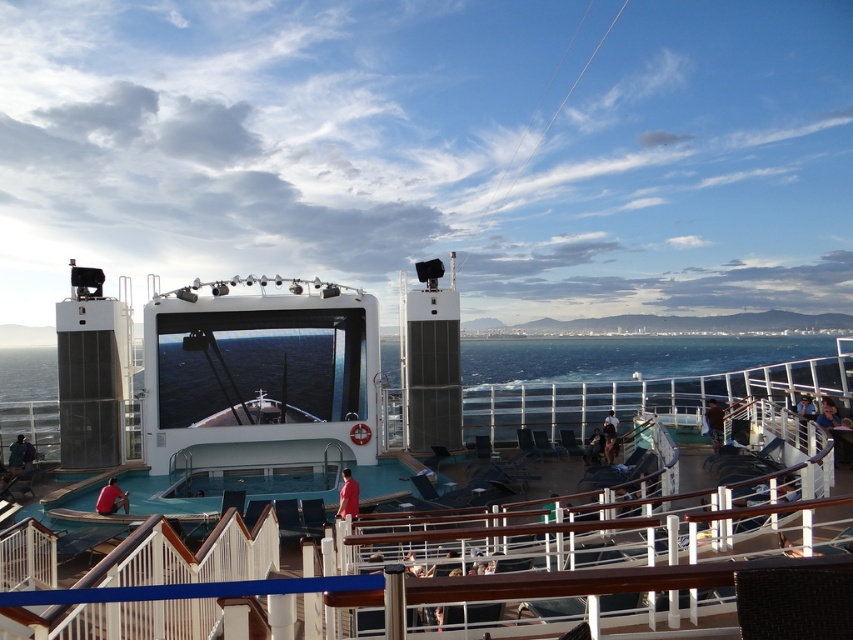
Question: Estimate the real-world distances between objects in this image. Which object is closer to the brown leather jacket at lower right?

Choices:
 (A) dark blue shirt at center
 (B) white glossy stage at center
 (C) blue water at center
 (D) red matte shirt at lower center

Answer: (A)

Question: In this image, where is red matte shirt at lower center located relative to brown leather jacket at lower right?

Choices:
 (A) right
 (B) left

Answer: (B)

Question: Can you confirm if white glossy stage at center is wider than red matte shirt at lower center?

Choices:
 (A) yes
 (B) no

Answer: (A)

Question: Observing the image, what is the correct spatial positioning of white glossy stage at center in reference to red matte shirt at lower center?

Choices:
 (A) below
 (B) above

Answer: (B)

Question: Which point is farther to the camera?

Choices:
 (A) (492, 344)
 (B) (357, 493)

Answer: (A)

Question: Which object is the closest to the matte red shirt at lower left?

Choices:
 (A) dark blue shirt at center
 (B) dark blue fabric at lower left

Answer: (B)